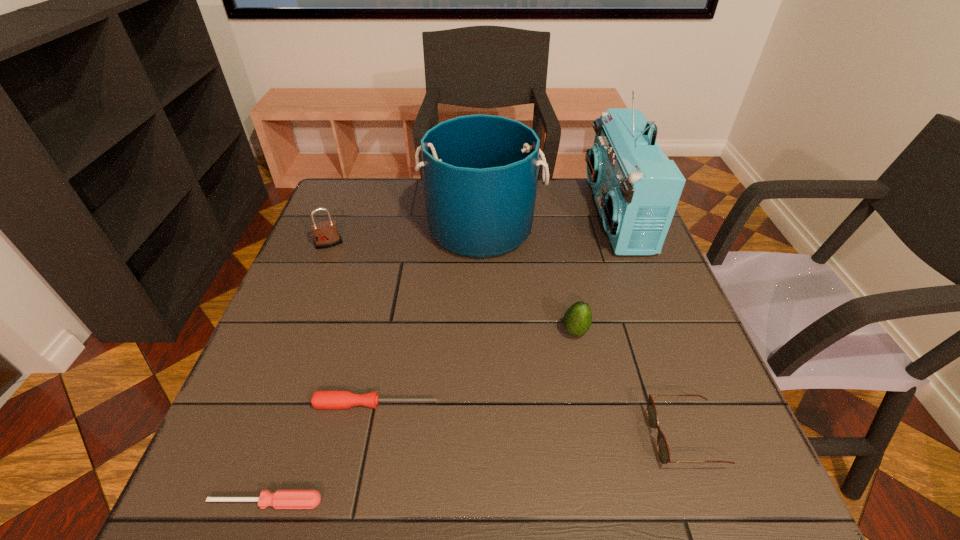
In order to click on radio receiver in this screenshot , I will do pos(637,188).

Find the location of a particular element. bucket is located at coordinates (480, 172).

This screenshot has height=540, width=960. I want to click on the third tallest object, so click(x=325, y=233).

Where is `the fourth farthest object`? This screenshot has height=540, width=960. the fourth farthest object is located at coordinates (577, 320).

I want to click on avocado, so click(x=577, y=320).

This screenshot has height=540, width=960. I want to click on the fifth tallest object, so pyautogui.click(x=663, y=450).

Where is `the farther screwdriver`? the farther screwdriver is located at coordinates (335, 399).

The height and width of the screenshot is (540, 960). I want to click on the nearer screwdriver, so click(282, 499).

Find the location of `free location located on the front-facing side of the radio receiver`. free location located on the front-facing side of the radio receiver is located at coordinates (490, 215).

The height and width of the screenshot is (540, 960). I want to click on vacant space located on the front-facing side of the radio receiver, so click(x=520, y=215).